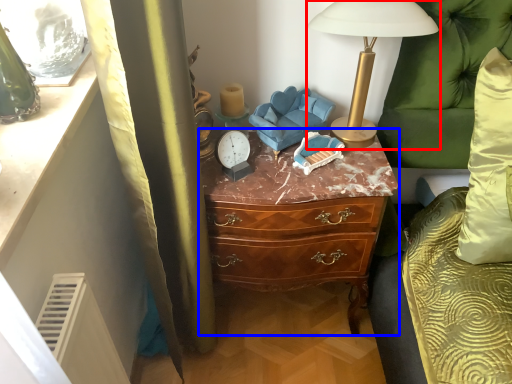
Question: Which object appears closest to the camera in this image, lamp (highlighted by a red box) or chest of drawers (highlighted by a blue box)?

Choices:
 (A) lamp
 (B) chest of drawers

Answer: (A)